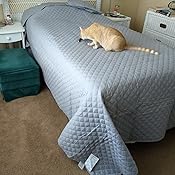
Find the location of a particular element. The image size is (175, 175). headboard is located at coordinates (15, 12).